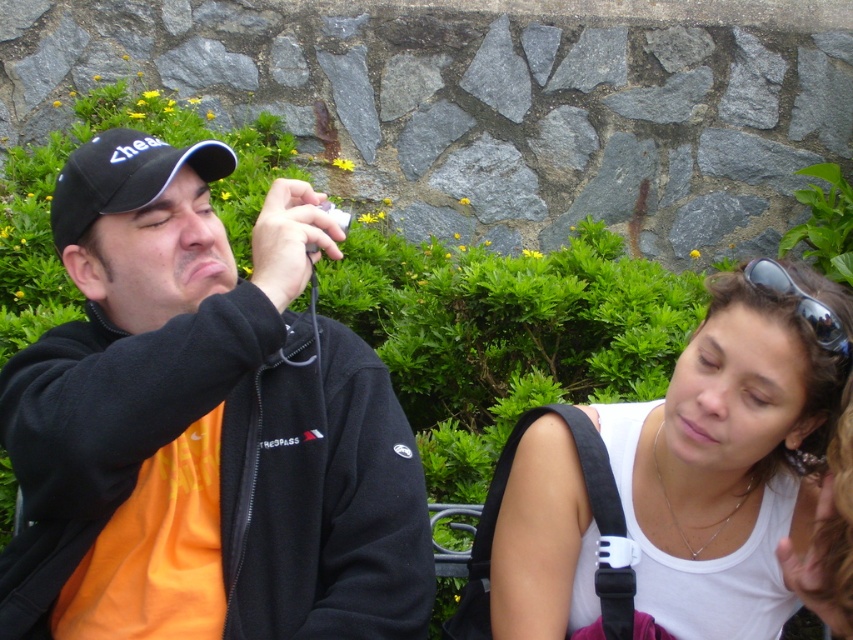
Can you confirm if white matte tank top at center is positioned below black matte baseball cap at upper left?

Yes, white matte tank top at center is below black matte baseball cap at upper left.

Does white matte tank top at center have a lesser height compared to black matte baseball cap at upper left?

No, white matte tank top at center is not shorter than black matte baseball cap at upper left.

Who is more forward, (776, 380) or (131, 182)?

Point (776, 380) is in front.

This screenshot has width=853, height=640. Identify the location of white matte tank top at center. (733, 451).

Which of these two, black matte camera at center or white matte tank top at center, stands shorter?

With less height is white matte tank top at center.

Who is more forward, (x=387, y=632) or (x=680, y=360)?

Point (x=387, y=632)

Does point (105, 225) come farther from viewer compared to point (770, 320)?

Yes, it is.

The height and width of the screenshot is (640, 853). In order to click on black matte camera at center in this screenshot , I will do `click(202, 426)`.

Who is shorter, black matte camera at center or black matte baseball cap at upper left?

black matte baseball cap at upper left is shorter.

Is point (326, 252) less distant than point (122, 129)?

Yes, it is.

Does point (82, 609) lie in front of point (100, 173)?

Yes, it is in front of point (100, 173).

At what (x,y) coordinates should I click in order to perform the action: click on black matte camera at center. Please return your answer as a coordinate pair (x, y). The width and height of the screenshot is (853, 640). Looking at the image, I should click on (202, 426).